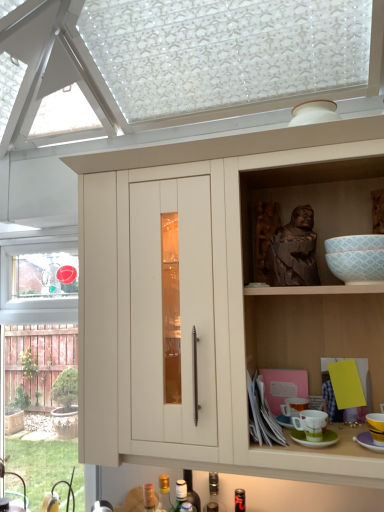
Question: Considering the positions of matte wood cabinet at center and translucent glass bottle at lower center, acting as the first bottle starting from the left, in the image, is matte wood cabinet at center wider or thinner than translucent glass bottle at lower center, acting as the first bottle starting from the left,?

Choices:
 (A) thin
 (B) wide

Answer: (B)

Question: Looking at the image, does matte wood cabinet at center seem bigger or smaller compared to translucent glass bottle at lower center, the 4th bottle in the right-to-left sequence?

Choices:
 (A) small
 (B) big

Answer: (B)

Question: Which object is positioned closest to the translucent glass bottle at lower center, acting as the 2th bottle starting from the right?

Choices:
 (A) brown wooden statue at upper right
 (B) translucent glass bottle at lower center, acting as the first bottle starting from the left
 (C) white glossy bowl at upper right
 (D) matte wood cabinet at center
 (E) green matte saucer at lower right, arranged as the second saucer when viewed from the left

Answer: (B)

Question: Estimate the real-world distances between objects in this image. Which object is closer to the yellow matte cup at lower right, positioned as the first tableware in right-to-left order?

Choices:
 (A) translucent glass bottle at lower center, the 3th bottle in the right-to-left sequence
 (B) brown wooden statue at upper right
 (C) matte wood cabinet at center
 (D) matte ceramic mug at lower right, marked as the first tableware in a left-to-right arrangement
 (E) metallic glass bottle at lower center, the fourth bottle positioned from the left

Answer: (D)